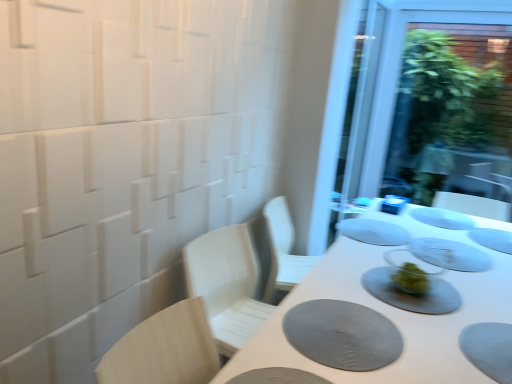
You are a GUI agent. You are given a task and a screenshot of the screen. Output one action in this format:
    pyautogui.click(x=<x>, y=<y>)
    Task: Click on the vacant area that lies between clear glass plate at center, the fifth tableware positioned from the back, and matte gray placemat at center, the first tableware in the front-to-back sequence
    The height and width of the screenshot is (384, 512).
    Given the screenshot: What is the action you would take?
    pyautogui.click(x=432, y=270)